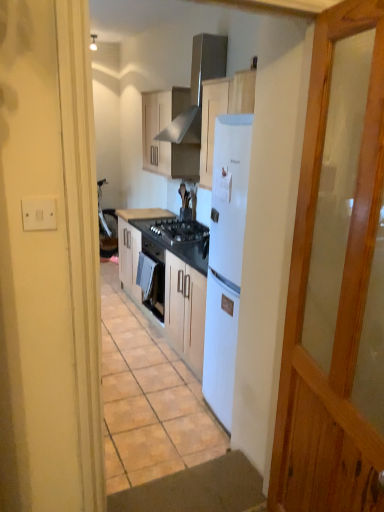
Question: Based on their sizes in the image, would you say white plastic switch at upper left is bigger or smaller than black glass gas stove at center?

Choices:
 (A) small
 (B) big

Answer: (A)

Question: Is white plastic switch at upper left in front of or behind black glass gas stove at center in the image?

Choices:
 (A) front
 (B) behind

Answer: (A)

Question: Which is farther from the black granite countertop at center, positioned as the 2th countertop in top-to-bottom order?

Choices:
 (A) white plastic switch at upper left
 (B) stainless steel exhaust hood at upper center
 (C) black laminate countertop at center, positioned as the 2th countertop in bottom-to-top order
 (D) matte wood cabinets at center
 (E) black glass gas stove at center

Answer: (A)

Question: Which object is the closest to the black laminate countertop at center, which is counted as the 1th countertop, starting from the top?

Choices:
 (A) black glass gas stove at center
 (B) stainless steel exhaust hood at upper center
 (C) white plastic switch at upper left
 (D) matte wood cabinets at center
 (E) black granite countertop at center, the first countertop when ordered from bottom to top

Answer: (A)